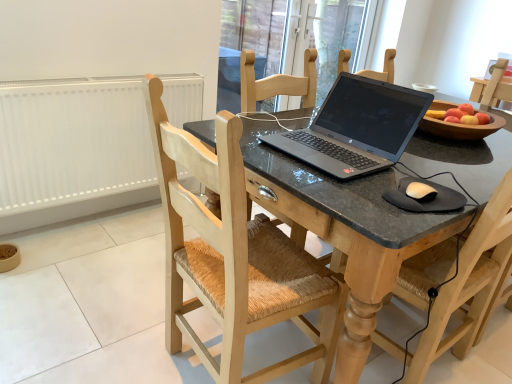
Where is `spots to the right of white matte mouse at lower right`? The image size is (512, 384). spots to the right of white matte mouse at lower right is located at coordinates (471, 190).